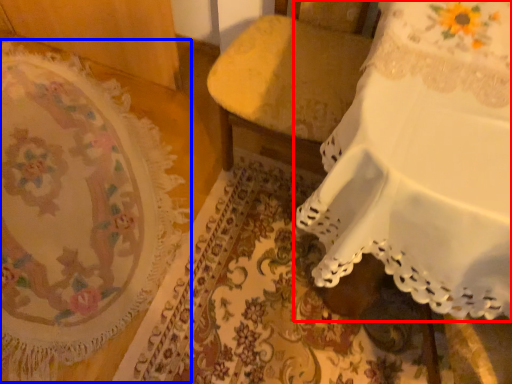
Question: Which point is further to the camera, furniture (highlighted by a red box) or mat (highlighted by a blue box)?

Choices:
 (A) furniture
 (B) mat

Answer: (B)